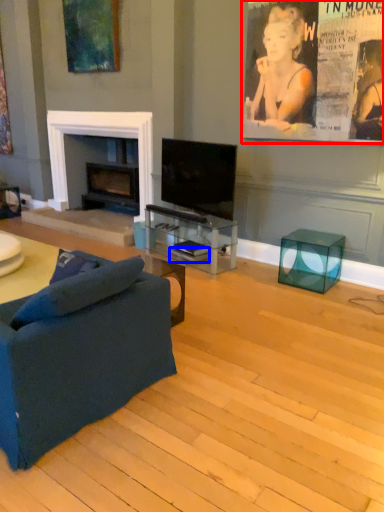
Question: Which point is closer to the camera, poster page (highlighted by a red box) or magazine (highlighted by a blue box)?

Choices:
 (A) poster page
 (B) magazine

Answer: (A)